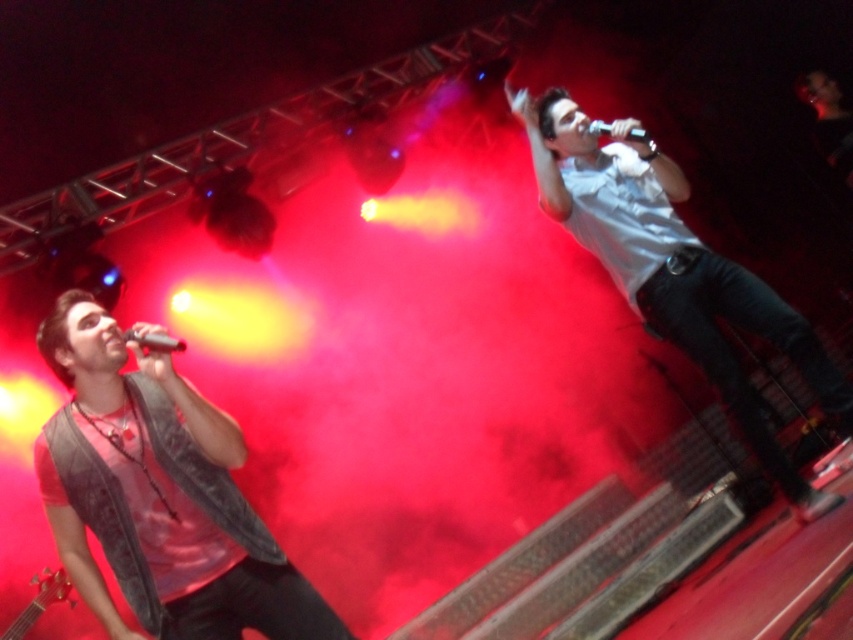
Question: Is metallic silver microphone at upper left thinner than metallic silver microphone at upper center?

Choices:
 (A) yes
 (B) no

Answer: (B)

Question: Does wooden acoustic guitar at lower left have a smaller size compared to metallic silver microphone at upper center?

Choices:
 (A) yes
 (B) no

Answer: (B)

Question: Is wooden acoustic guitar at lower left in front of metallic silver microphone at upper center?

Choices:
 (A) no
 (B) yes

Answer: (A)

Question: Which point is closer to the camera taking this photo?

Choices:
 (A) (42, 592)
 (B) (648, 138)
 (C) (154, 332)
 (D) (76, 579)

Answer: (C)

Question: Which point is farther from the camera taking this photo?

Choices:
 (A) (753, 326)
 (B) (90, 396)

Answer: (A)

Question: Which is farther from the metallic silver microphone at upper left?

Choices:
 (A) denim vest at left
 (B) metallic silver microphone at upper center
 (C) white matte shirt at upper right

Answer: (C)